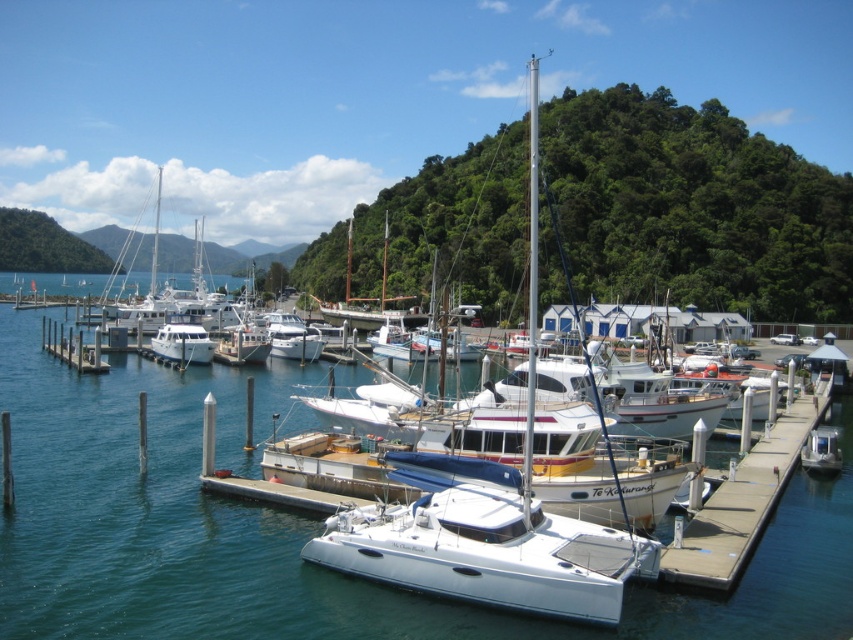
Question: Which point is closer to the camera?

Choices:
 (A) white glossy boat at center
 (B) white glossy water at center
 (C) white glossy catamaran at center

Answer: (C)

Question: Considering the real-world distances, which object is closest to the white glossy catamaran at center?

Choices:
 (A) white glossy water at center
 (B) white wooden dock at left
 (C) white glossy boat at center
 (D) smooth concrete dock at lower right

Answer: (D)

Question: Which point is farther from the camera taking this photo?

Choices:
 (A) (804, 426)
 (B) (190, 353)
 (C) (73, 337)

Answer: (C)

Question: Does white glossy catamaran at center appear under white glossy boat at center?

Choices:
 (A) yes
 (B) no

Answer: (A)

Question: Is white glossy catamaran at center bigger than white glossy boat at center?

Choices:
 (A) no
 (B) yes

Answer: (A)

Question: Can you confirm if white glossy catamaran at center is smaller than white glossy boat at center?

Choices:
 (A) no
 (B) yes

Answer: (B)